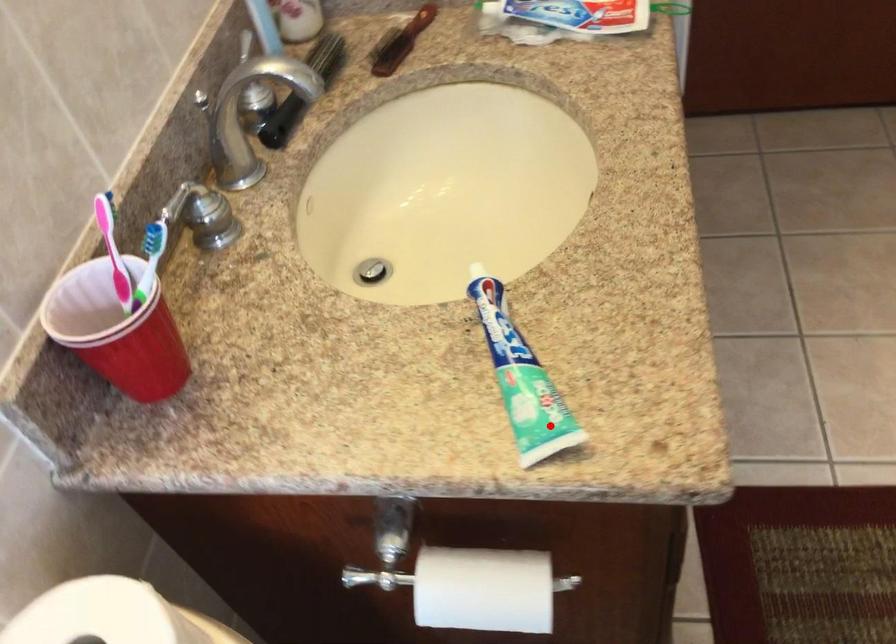
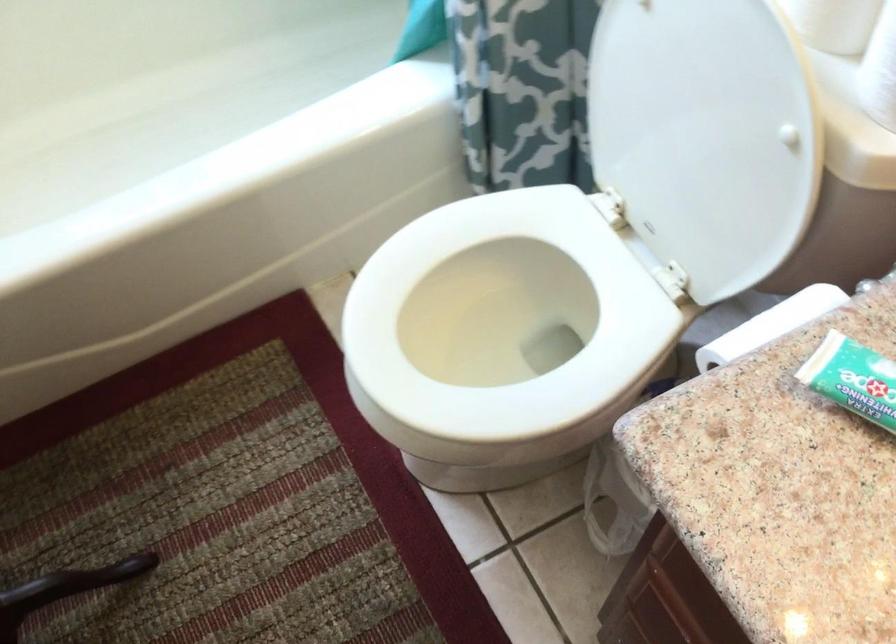
Locate, in the second image, the point that corresponds to the highlighted location in the first image.

(853, 379)